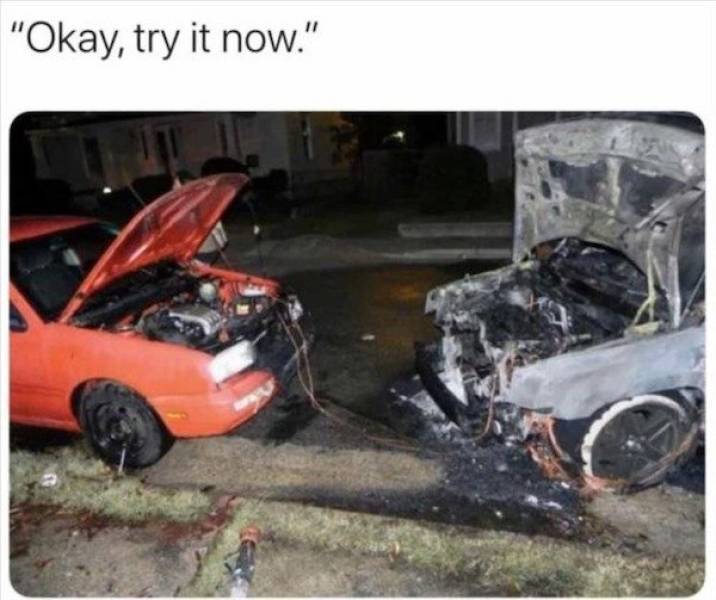
Find the location of `white trim on window`. white trim on window is located at coordinates (493, 145), (498, 119).